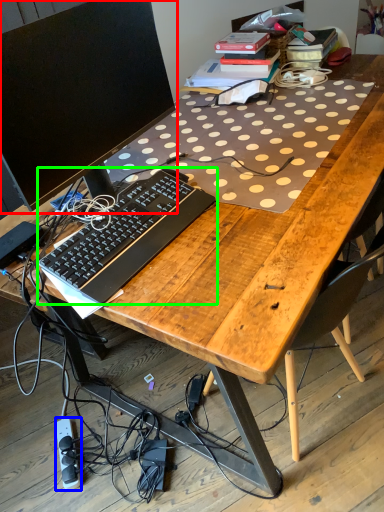
Question: Which is farther away from computer monitor (highlighted by a red box)? equipment (highlighted by a blue box) or computer keyboard (highlighted by a green box)?

Choices:
 (A) equipment
 (B) computer keyboard

Answer: (A)